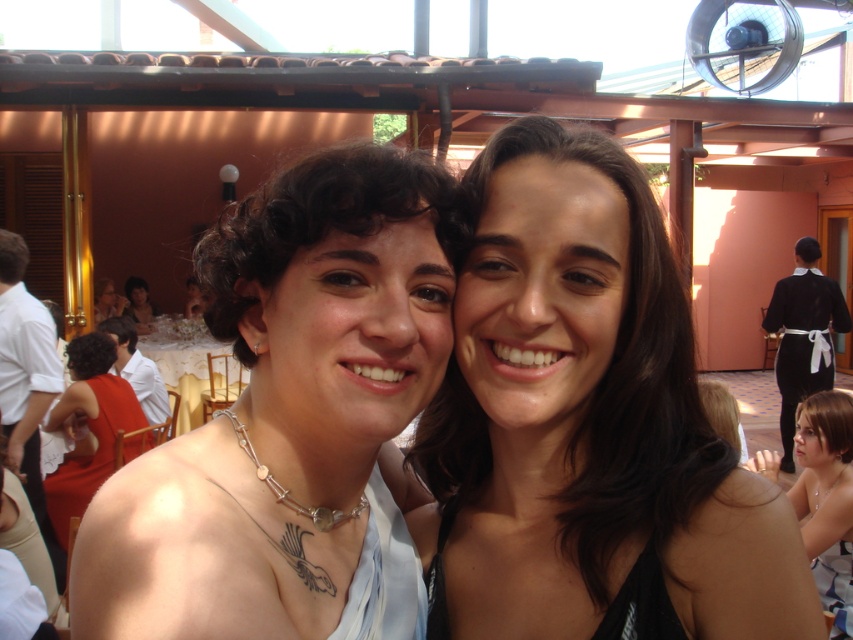
Question: Does matte red dress at left have a smaller size compared to black satin waiter at right?

Choices:
 (A) no
 (B) yes

Answer: (B)

Question: Among these points, which one is farthest from the camera?

Choices:
 (A) (421, 307)
 (B) (820, 388)
 (C) (102, 294)

Answer: (C)

Question: Does dark brown hair at center lie in front of matte black dress at center?

Choices:
 (A) yes
 (B) no

Answer: (A)

Question: Which point is farther to the camera?

Choices:
 (A) matte black dress at center
 (B) matte red dress at left
 (C) dark brown hair at center

Answer: (A)

Question: Does matte silver necklace at center have a greater width compared to matte red dress at left?

Choices:
 (A) no
 (B) yes

Answer: (A)

Question: Estimate the real-world distances between objects in this image. Which object is closer to the matte red dress at left?

Choices:
 (A) black satin waiter at right
 (B) matte silver necklace at center

Answer: (B)